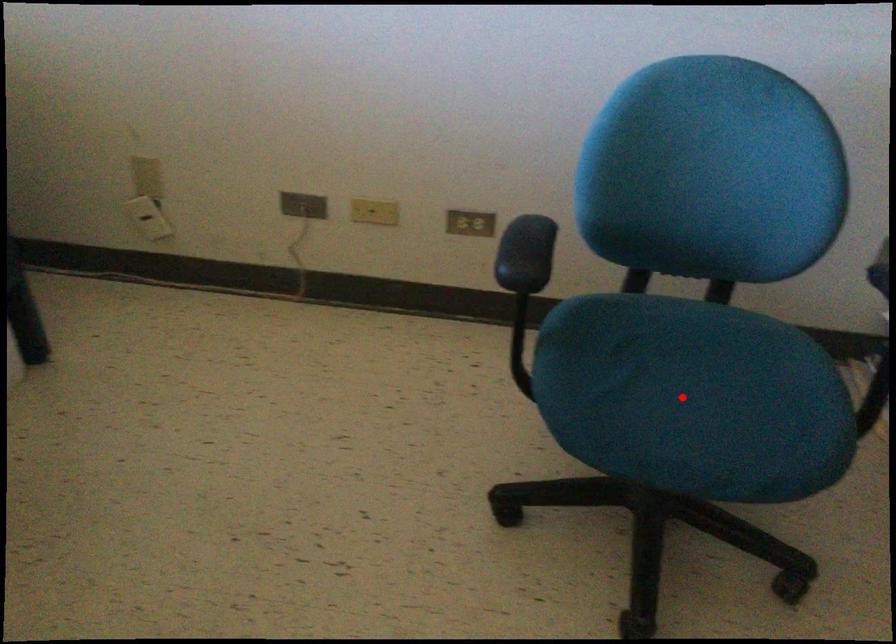
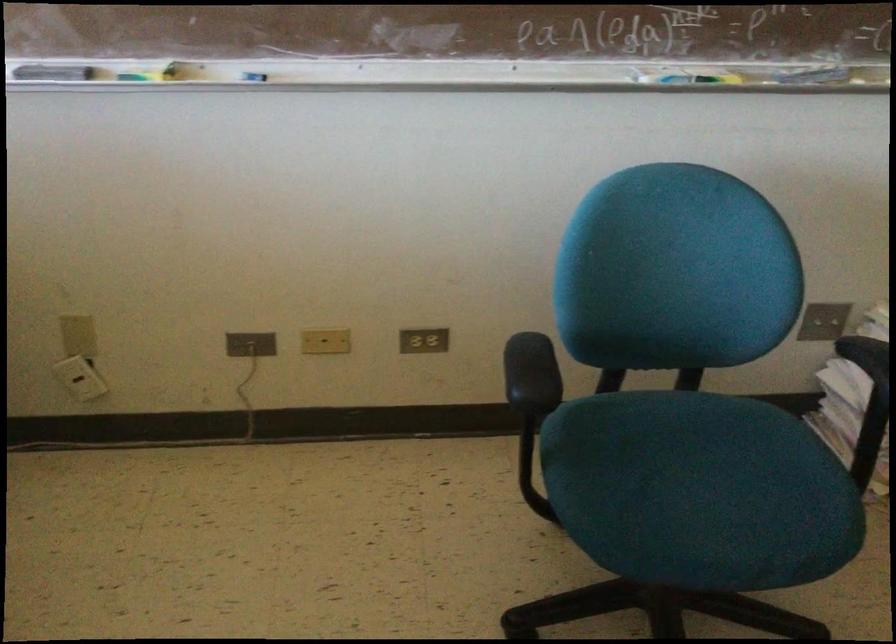
The point at the highlighted location is marked in the first image. Where is the corresponding point in the second image?

(700, 491)